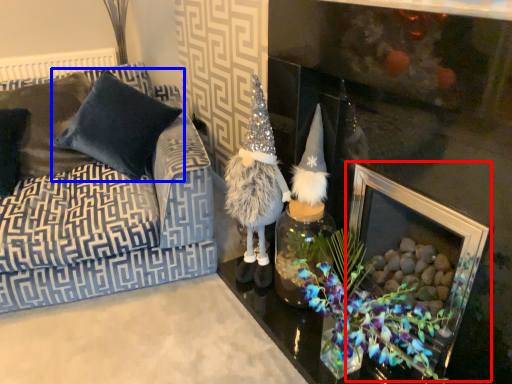
Question: Which of the following is the closest to the observer, picture frame (highlighted by a red box) or pillow (highlighted by a blue box)?

Choices:
 (A) picture frame
 (B) pillow

Answer: (A)